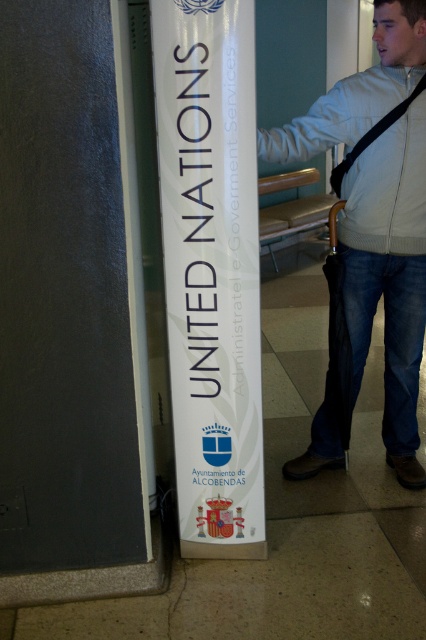
Is white paper sign at center above light gray zip-up jacket at center?

Actually, white paper sign at center is below light gray zip-up jacket at center.

Between point (199, 145) and point (391, 33), which one is positioned behind?

Point (391, 33)

Where is `white paper sign at center`? white paper sign at center is located at coordinates (210, 269).